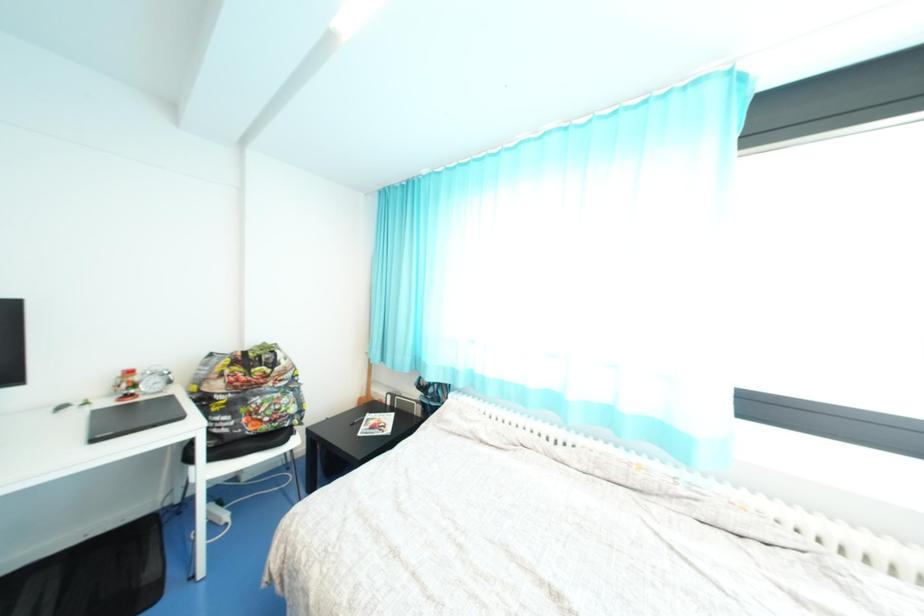
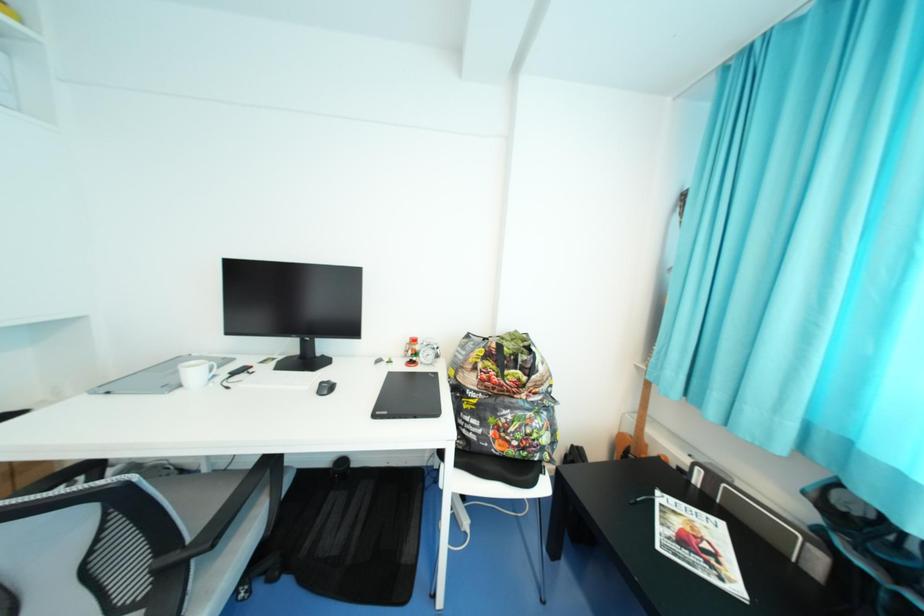
Question: The first image is from the beginning of the video and the second image is from the end. How did the camera likely rotate when shooting the video?

Choices:
 (A) Left
 (B) Right
 (C) Up
 (D) Down

Answer: (A)